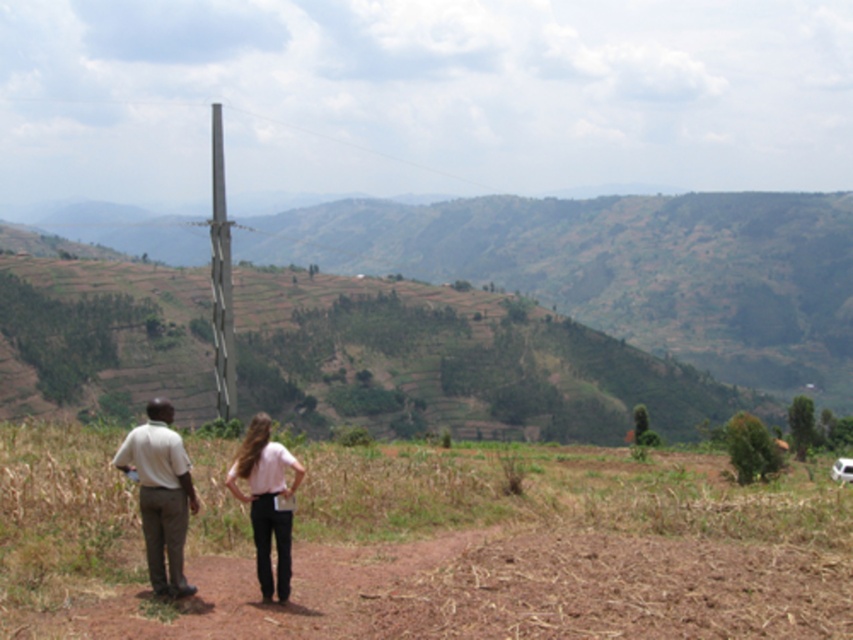
You are a photographer trying to capture a photo of the light brown cotton shirt at lower left and the pink fabric pants at center. From your current position, which object is closer to the camera?

The light brown cotton shirt at lower left is positioned under the pink fabric pants at center, so it is closer to the camera since it is in the lower part of the image.

You are a photographer setting up a camera on a tripod. You want to take a photo that includes both the light brown cotton shirt at lower left and the pink fabric pants at center. If your camera has a maximum focus range of 1 meter, will you be able to capture both subjects in focus?

The light brown cotton shirt at lower left is 1.16 meters away from the pink fabric pants at center. Since the distance between them exceeds the camera lens focus range of 1 meter, you might need to adjust your position or use a different lens to ensure both are in focus.

You are a photographer planning to capture a group photo of the two people wearing the light pink fabric shirt at center and the light brown cotton shirt at lower left. Considering their shirt widths, which person should you position closer to the camera to ensure both appear equally sized in the photo?

The light pink fabric shirt at center is wider than the light brown cotton shirt at lower left. To make both shirts appear equally sized in the photo, position the person in the light brown cotton shirt at lower left slightly closer to the camera since their shirt is narrower.